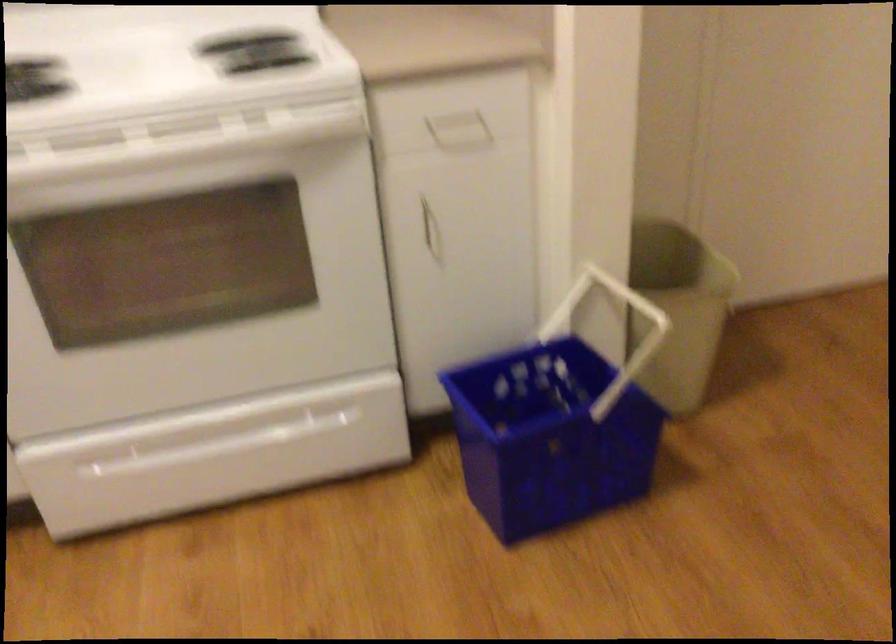
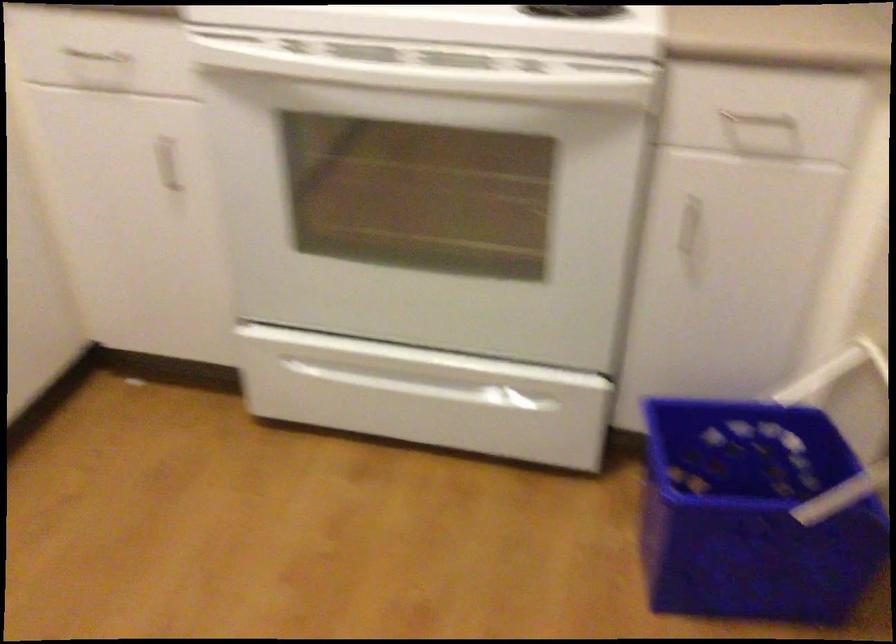
Where in the second image is the point corresponding to pixel 169 138 from the first image?

(437, 77)